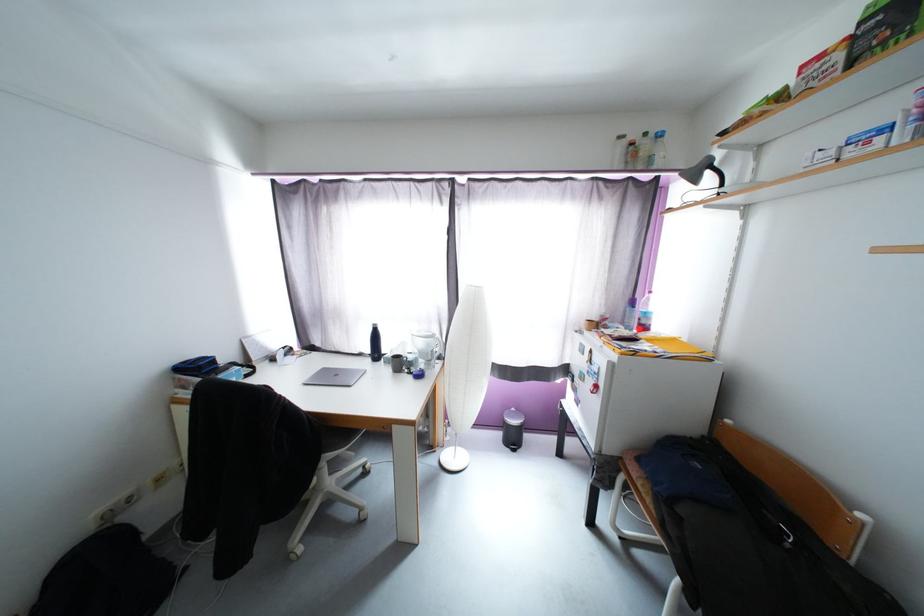
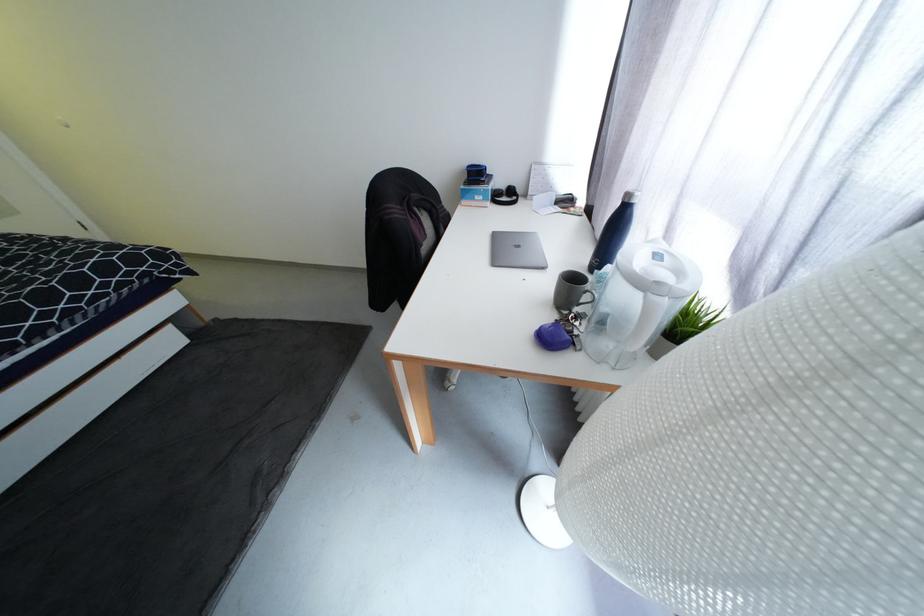
Where in the second image is the point corresponding to (377,331) from the first image?

(626, 205)